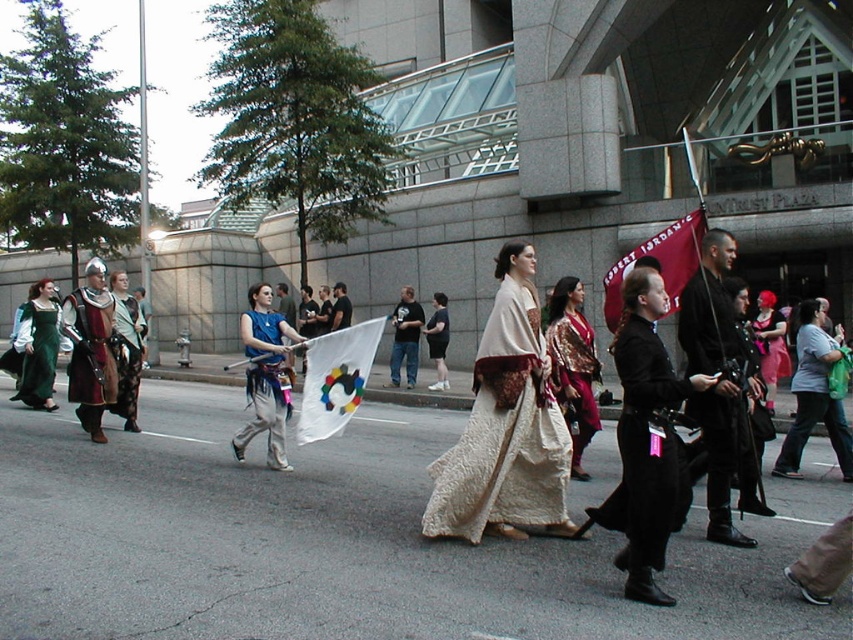
Can you confirm if blue fabric vest at center is wider than matte blue armor at center?

No, blue fabric vest at center is not wider than matte blue armor at center.

Does blue fabric vest at center appear on the right side of matte blue armor at center?

Yes, blue fabric vest at center is to the right of matte blue armor at center.

You are a GUI agent. You are given a task and a screenshot of the screen. Output one action in this format:
    pyautogui.click(x=<x>, y=<y>)
    Task: Click on the blue fabric vest at center
    Image resolution: width=853 pixels, height=640 pixels.
    Given the screenshot: What is the action you would take?
    pyautogui.click(x=265, y=376)

The width and height of the screenshot is (853, 640). In order to click on blue fabric vest at center in this screenshot , I will do `click(265, 376)`.

Which is above, green fabric bag at lower right or shiny silver armor at left?

shiny silver armor at left

Between point (805, 301) and point (126, 385), which one is positioned in front?

Positioned in front is point (805, 301).

Find the location of `green fabric bag at lower right`. green fabric bag at lower right is located at coordinates pyautogui.click(x=814, y=396).

Is black velvet cape at center to the right of silky gold kimono at center from the viewer's perspective?

Incorrect, black velvet cape at center is not on the right side of silky gold kimono at center.

Who is positioned more to the left, black velvet cape at center or silky gold kimono at center?

Positioned to the left is black velvet cape at center.

Is point (675, 410) behind point (573, 292)?

No, it is not.

This screenshot has width=853, height=640. Find the location of `black velvet cape at center`. black velvet cape at center is located at coordinates (643, 448).